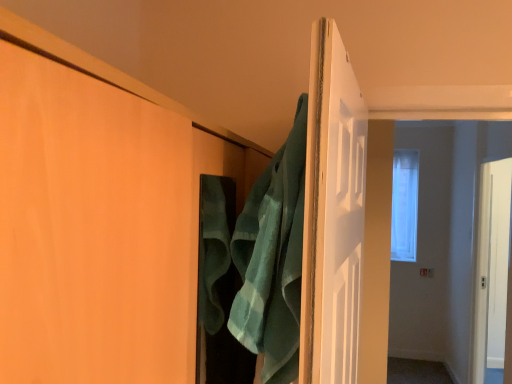
Question: In terms of width, does green terry cloth bath towel at center look wider or thinner when compared to matte wood door at center?

Choices:
 (A) wide
 (B) thin

Answer: (B)

Question: Is point (274, 382) positioned closer to the camera than point (160, 365)?

Choices:
 (A) farther
 (B) closer

Answer: (A)

Question: Estimate the real-world distances between objects in this image. Which object is closer to the clear glass window at center?

Choices:
 (A) green terry cloth bath towel at center
 (B) matte wood door at center

Answer: (A)

Question: Based on their relative distances, which object is farther from the green terry cloth bath towel at center?

Choices:
 (A) clear glass window at center
 (B) matte wood door at center

Answer: (A)